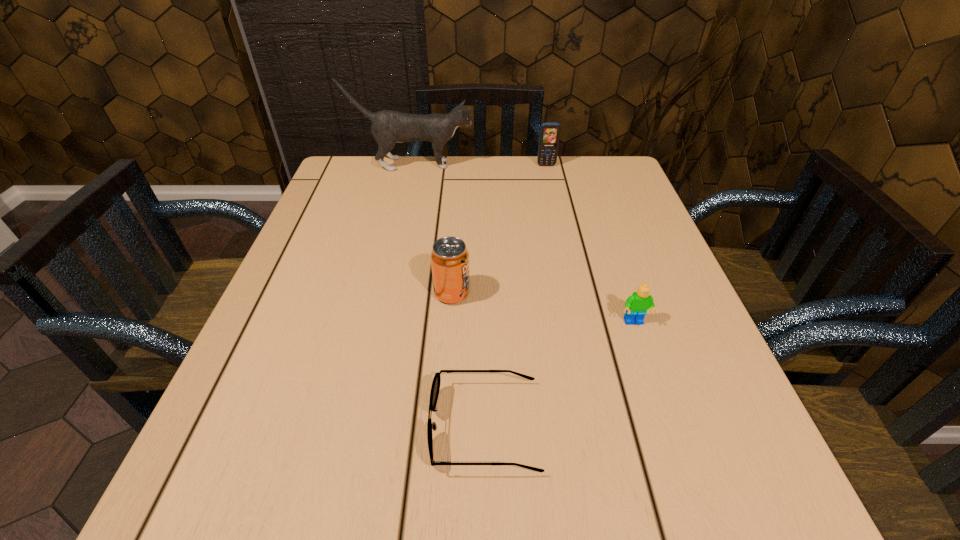
Identify the location of free space located on the face of the fourth tallest object. (646, 360).

Find the location of `free space located on the front-facing side of the spectacles`. free space located on the front-facing side of the spectacles is located at coordinates (304, 426).

Where is `free space located on the front-facing side of the spectacles`? Image resolution: width=960 pixels, height=540 pixels. free space located on the front-facing side of the spectacles is located at coordinates pyautogui.click(x=251, y=426).

You are a GUI agent. You are given a task and a screenshot of the screen. Output one action in this format:
    pyautogui.click(x=<x>, y=<y>)
    Task: Click on the free region located on the front-facing side of the spectacles
    
    Given the screenshot: What is the action you would take?
    pyautogui.click(x=357, y=426)

Identify the location of cat that is at the far edge. Image resolution: width=960 pixels, height=540 pixels. (388, 127).

You are a GUI agent. You are given a task and a screenshot of the screen. Output one action in this format:
    pyautogui.click(x=<x>, y=<y>)
    Task: Click on the cellular telephone located at the far edge
    This screenshot has height=540, width=960.
    Given the screenshot: What is the action you would take?
    pyautogui.click(x=549, y=136)

Image resolution: width=960 pixels, height=540 pixels. I want to click on object present at the near edge, so click(x=435, y=387).

Where is `object present at the left edge`? object present at the left edge is located at coordinates (388, 127).

You are a GUI agent. You are given a task and a screenshot of the screen. Output one action in this format:
    pyautogui.click(x=<x>, y=<y>)
    Task: Click on the object located at the right edge
    The height and width of the screenshot is (540, 960).
    Given the screenshot: What is the action you would take?
    pyautogui.click(x=637, y=304)

Locate an element on the screen. object located in the far left corner section of the desktop is located at coordinates (388, 127).